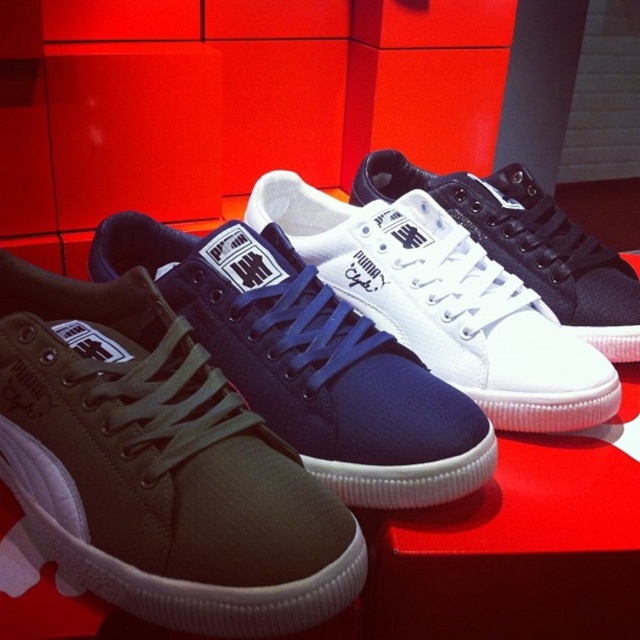
You are a store employee arranging Puma sneakers on a display. You have an olive green canvas sneaker at center and an olive canvas sneaker at center. Which one is shorter in height?

The olive green canvas sneaker at center is not as tall as the olive canvas sneaker at center, so the olive green canvas sneaker at center is shorter in height.

You are a store employee arranging shoes on a display. You notice the olive green canvas sneaker at center and the white canvas sneaker at center. Which shoe is placed lower in the arrangement?

The olive green canvas sneaker at center is positioned under the white canvas sneaker at center, so it is placed lower in the arrangement.

Looking at this image, you are standing in front of a display of Puma sneakers arranged on a red platform. You notice a point marked at coordinates [157,467]. Which sneaker does this point belong to?

The point is on the olive green canvas sneaker at center.